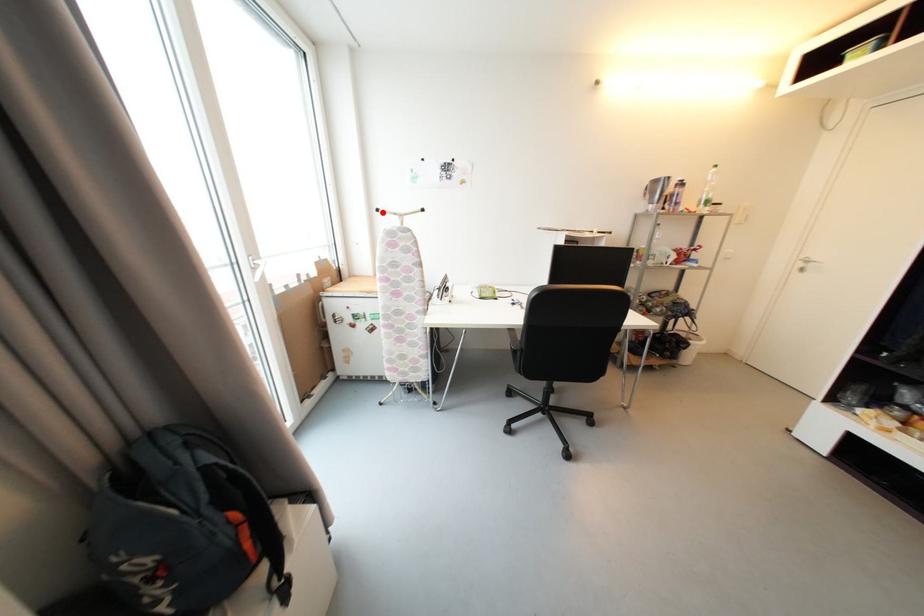
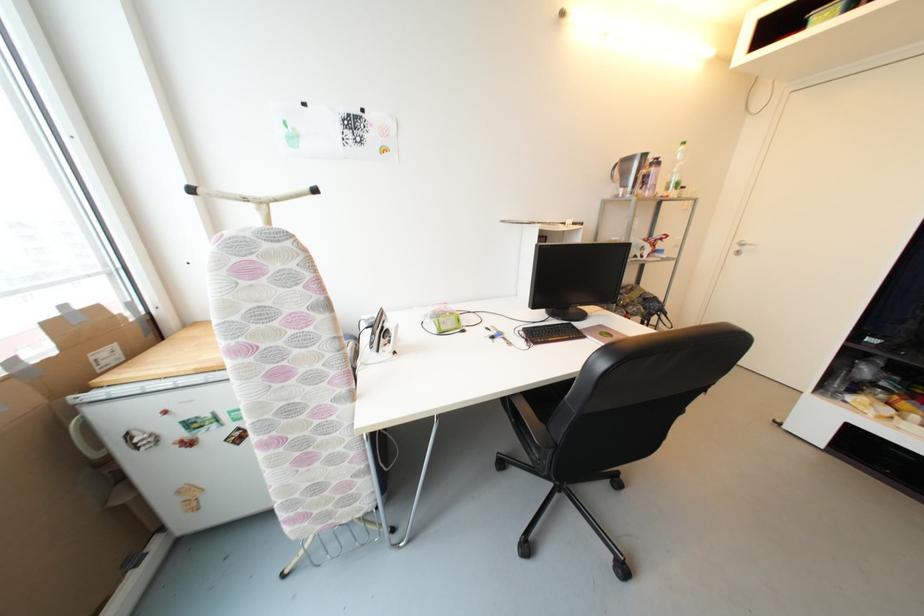
Question: I am providing you with two images of the same scene from different viewpoints. Given a red point in image1, look at the same physical point in image2. Is it:

Choices:
 (A) Closer to the viewpoint
 (B) Farther from the viewpoint

Answer: (B)